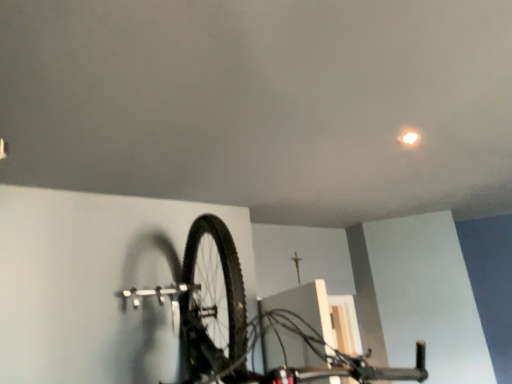
What do you see at coordinates (409, 137) in the screenshot? I see `matte white light at upper right` at bounding box center [409, 137].

This screenshot has height=384, width=512. I want to click on matte white light at upper right, so click(x=409, y=137).

What are the coordinates of `matte white light at upper right` in the screenshot? It's located at coord(409,137).